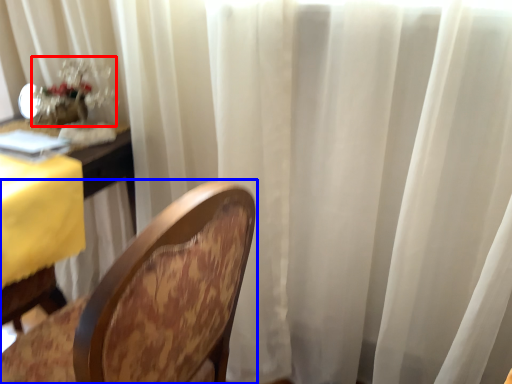
Question: Which object appears closest to the camera in this image, floral arrangement (highlighted by a red box) or chair (highlighted by a blue box)?

Choices:
 (A) floral arrangement
 (B) chair

Answer: (B)